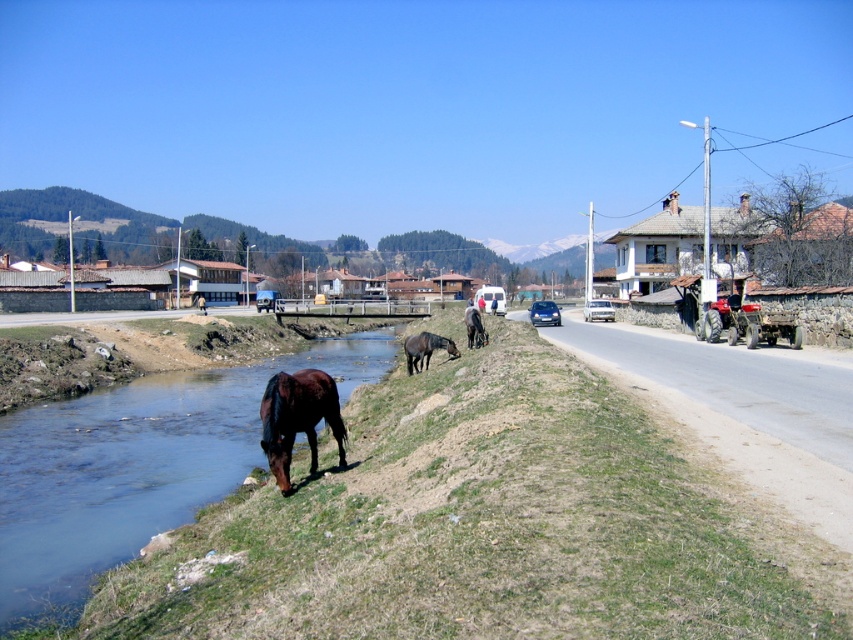
You are standing at the red tractor parked on the right side of the road near the buildings. You want to walk to the point that is closer to the river. Which point should you go to, point (281, 481) or point (469, 348)?

Point (281, 481) is in front of point (469, 348), so it is closer to the river. Therefore, you should go to point (281, 481).

You are standing at the edge of the river in the image and want to reach the point marked at coordinates point (55, 461). Given that you can walk 10 feet per minute, how long will it take you to reach that point?

The distance of point (55, 461) from viewer is 46.07 feet, so it will take approximately 4.6 minutes to reach the point since 46.07 divided by 10 equals 4.607 minutes.